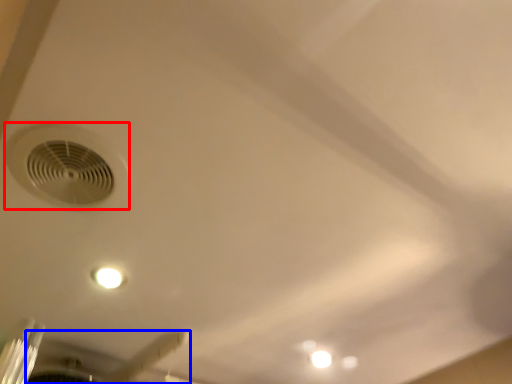
Question: Which point is further to the camera, air conditioning (highlighted by a red box) or ceiling fan (highlighted by a blue box)?

Choices:
 (A) air conditioning
 (B) ceiling fan

Answer: (B)